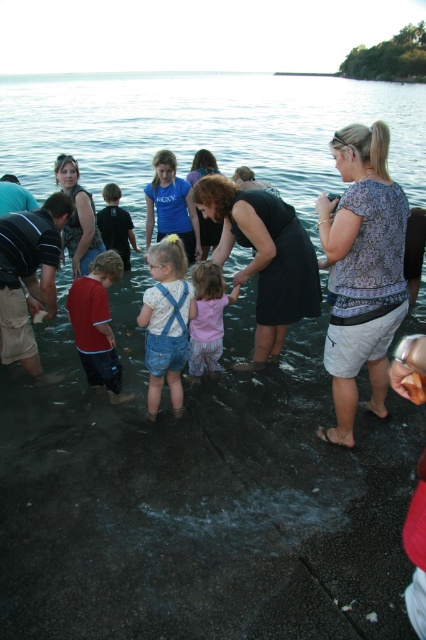
Question: Is printed cotton blouse at center thinner than pink cotton shirt at center?

Choices:
 (A) no
 (B) yes

Answer: (A)

Question: Does dark brown leather jacket at left have a smaller size compared to red cotton shirt at center?

Choices:
 (A) yes
 (B) no

Answer: (B)

Question: Considering the real-world distances, which object is farthest from the pink cotton shirt at center?

Choices:
 (A) dark brown leather jacket at left
 (B) matte black dress at center
 (C) black dress at center

Answer: (B)

Question: Which object is closer to the camera taking this photo?

Choices:
 (A) matte black shirt at center
 (B) pink cotton shirt at center
 (C) denim overalls at center
 (D) dark brown leather jacket at left

Answer: (C)

Question: Can you confirm if dark brown leather jacket at left is positioned to the left of pink cotton shirt at center?

Choices:
 (A) no
 (B) yes

Answer: (B)

Question: Which object appears farthest from the camera in this image?

Choices:
 (A) matte black dress at center
 (B) blue cotton shirt at center

Answer: (B)